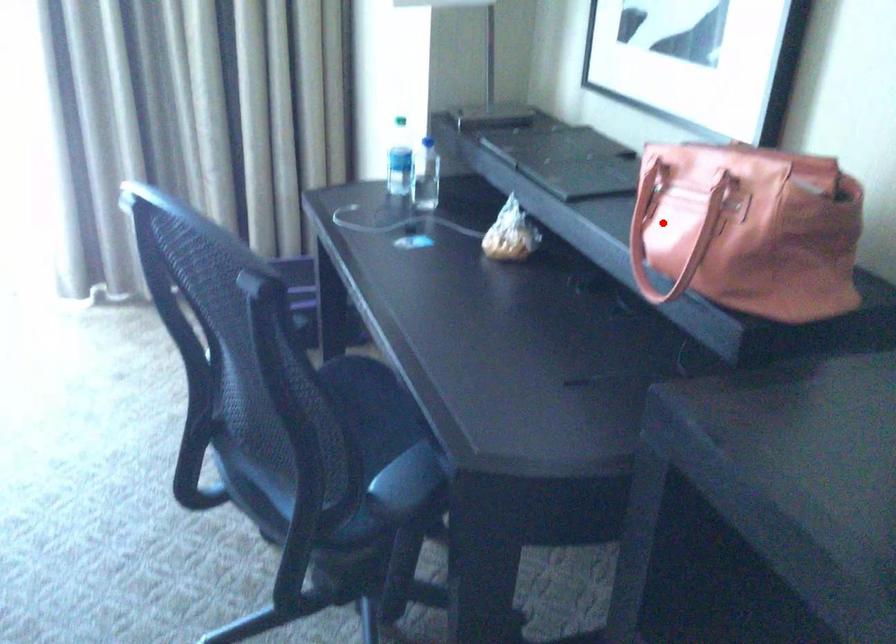
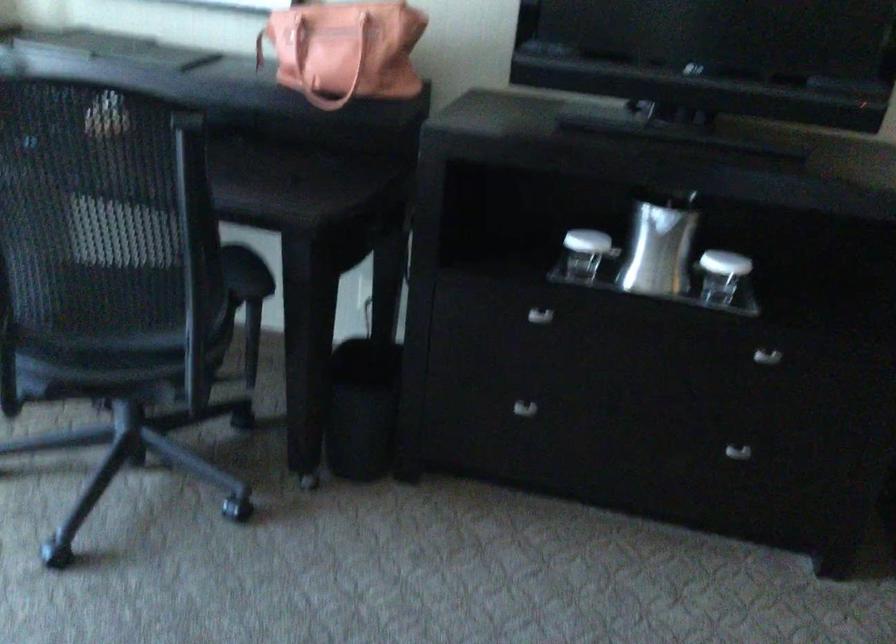
Question: I am providing you with two images of the same scene from different viewpoints. In image1, a red point is highlighted. Considering the same 3D point in image2, which of the following is correct?

Choices:
 (A) It is closer
 (B) It is farther

Answer: (B)